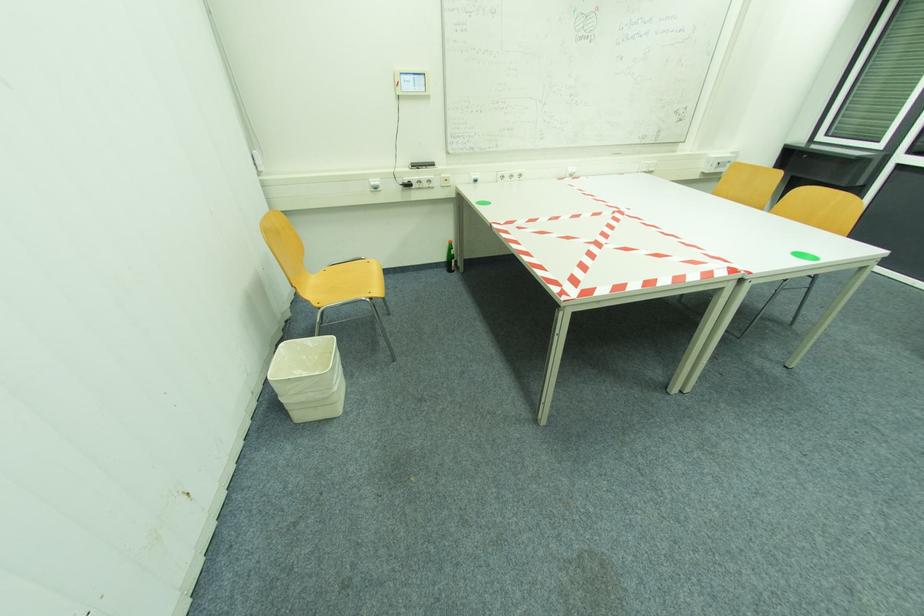
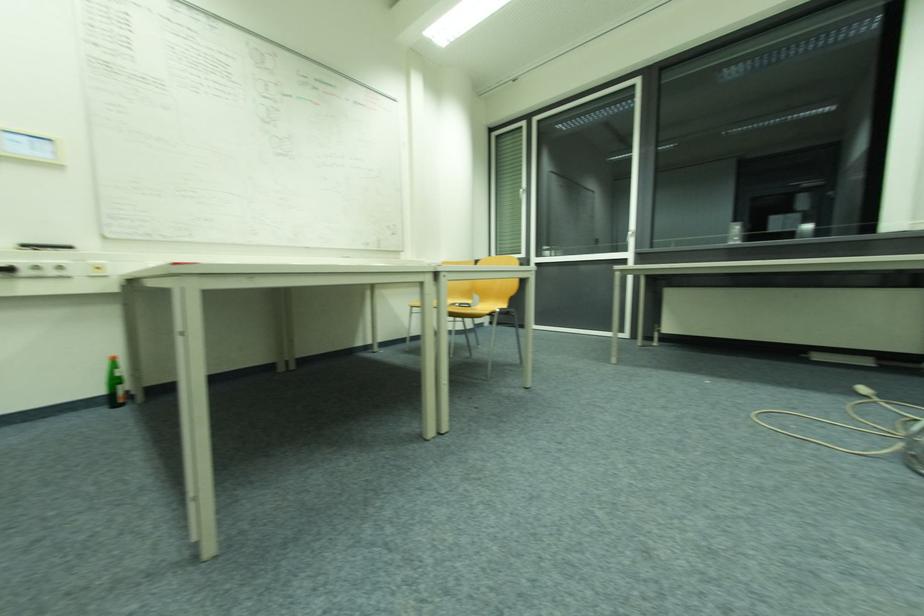
The first image is from the beginning of the video and the second image is from the end. How did the camera likely rotate when shooting the video?

The rotation direction of the camera is right-up.